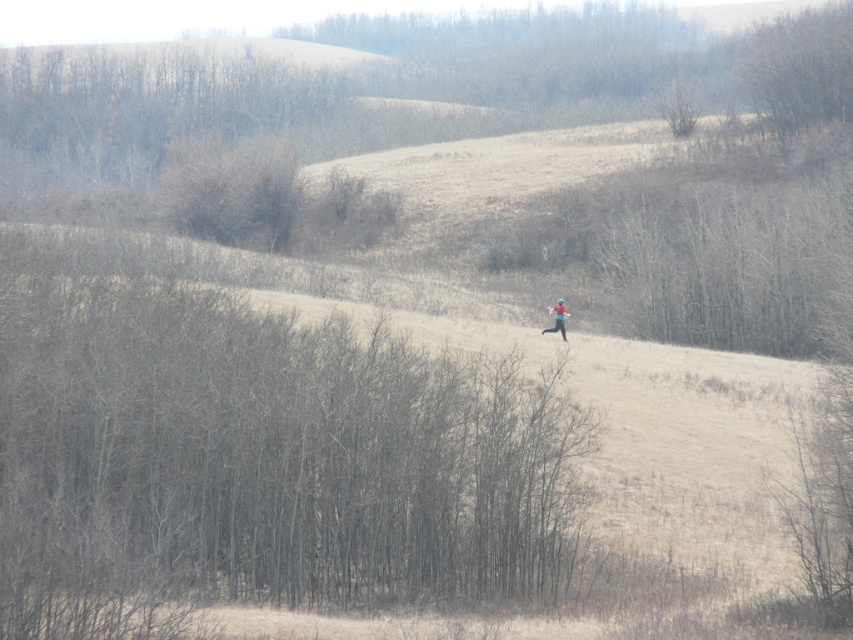
Does brown matte tree at center have a greater width compared to bare branches at upper right?

Yes.

Who is positioned more to the right, brown matte tree at center or bare branches at upper right?

From the viewer's perspective, bare branches at upper right appears more on the right side.

Between point (302, 340) and point (846, 116), which one is positioned in front?

Point (302, 340)

The height and width of the screenshot is (640, 853). Find the location of `brown matte tree at center`. brown matte tree at center is located at coordinates (259, 460).

Consider the image. Which is more to the right, brown matte tree at center or blue fabric skier at center?

Positioned to the right is blue fabric skier at center.

The height and width of the screenshot is (640, 853). Describe the element at coordinates (259, 460) in the screenshot. I see `brown matte tree at center` at that location.

Is point (276, 429) closer to camera compared to point (552, 308)?

Yes, it is in front of point (552, 308).

This screenshot has width=853, height=640. I want to click on brown matte tree at center, so click(x=259, y=460).

Which of these two, bare branches at upper right or blue fabric skier at center, stands taller?

bare branches at upper right

Which is in front, point (756, 90) or point (555, 310)?

Point (555, 310) is in front.

Find the location of a particular element. bare branches at upper right is located at coordinates (799, 68).